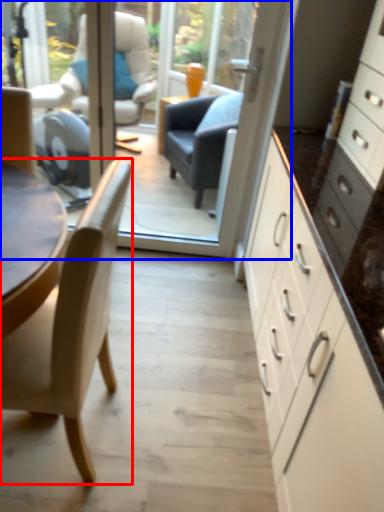
Question: Which of the following is the farthest to the observer, chair (highlighted by a red box) or glass door (highlighted by a blue box)?

Choices:
 (A) chair
 (B) glass door

Answer: (B)